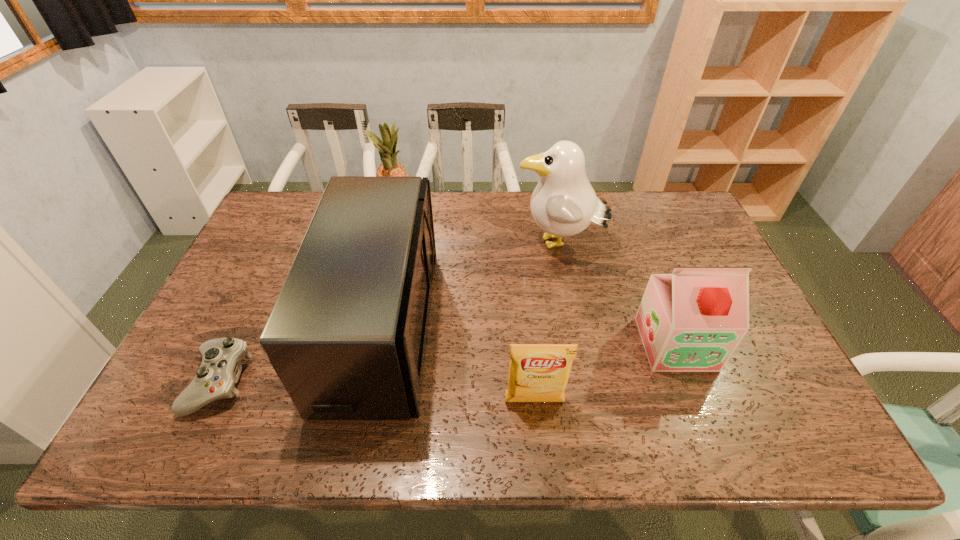
Where is `object present at the left edge`? The image size is (960, 540). object present at the left edge is located at coordinates (220, 368).

The width and height of the screenshot is (960, 540). Find the location of `object situated at the right edge`. object situated at the right edge is located at coordinates (692, 320).

At what (x,y) coordinates should I click in order to perform the action: click on object that is at the near left corner. Please return your answer as a coordinate pair (x, y). This screenshot has width=960, height=540. Looking at the image, I should click on (220, 368).

Where is `vacant region at the far edge`? The width and height of the screenshot is (960, 540). vacant region at the far edge is located at coordinates (500, 215).

Where is `free space at the near edge of the desktop`? This screenshot has height=540, width=960. free space at the near edge of the desktop is located at coordinates (524, 422).

Locate an element on the screen. vacant space at the left edge of the desktop is located at coordinates (223, 288).

In the image, there is a desktop. At what (x,y) coordinates should I click in order to perform the action: click on blank space at the far left corner. Please return your answer as a coordinate pair (x, y). The width and height of the screenshot is (960, 540). Looking at the image, I should click on (315, 207).

What are the coordinates of `free space that is in between the gull and the pineapple` in the screenshot? It's located at [x=478, y=229].

The height and width of the screenshot is (540, 960). Find the location of `vacant area between the crisp (potato chip) and the gull`. vacant area between the crisp (potato chip) and the gull is located at coordinates 546,323.

I want to click on free space between the microwave_oven and the fifth tallest object, so (458, 364).